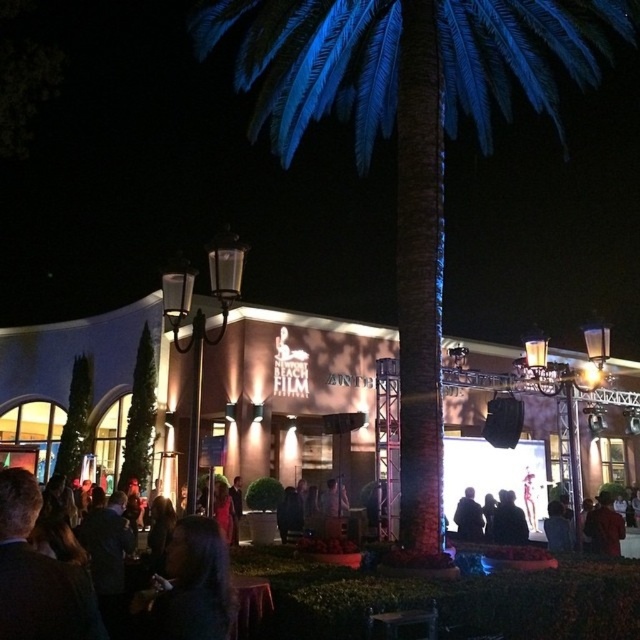
Is blue artificial palm tree at center above dark gray suit at lower left?

Indeed, blue artificial palm tree at center is positioned over dark gray suit at lower left.

Find the location of a particular element. blue artificial palm tree at center is located at coordinates (410, 136).

What do you see at coordinates (410, 136) in the screenshot?
I see `blue artificial palm tree at center` at bounding box center [410, 136].

Locate an element on the screen. The height and width of the screenshot is (640, 640). blue artificial palm tree at center is located at coordinates (410, 136).

Does point (22, 500) come closer to viewer compared to point (612, 516)?

Yes.

Which is in front, point (20, 621) or point (609, 538)?

Point (20, 621) is in front.

You are a GUI agent. You are given a task and a screenshot of the screen. Output one action in this format:
    pyautogui.click(x=<x>, y=<y>)
    Task: Click on the dark gray suit at lower left
    The image size is (640, 640).
    Given the screenshot: What is the action you would take?
    pyautogui.click(x=38, y=573)

I want to click on dark gray suit at lower left, so click(x=38, y=573).

Measure the distance between blue artificial palm tree at center and silky black hair at lower center.

50.57 feet

Is point (349, 61) closer to camera compared to point (500, 492)?

No, it is behind (500, 492).

Who is more forward, (600, 1) or (506, 497)?

Point (600, 1) is more forward.

Identify the location of blue artificial palm tree at center. (410, 136).